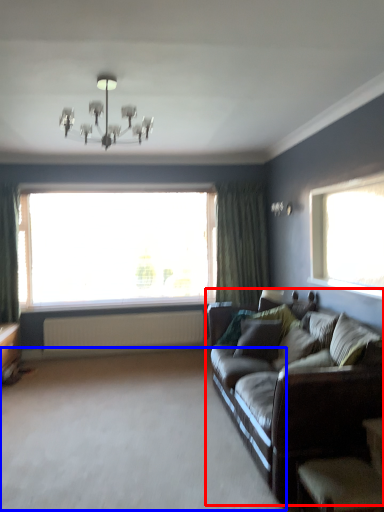
Question: Which point is closer to the camera, studio couch (highlighted by a red box) or plain (highlighted by a blue box)?

Choices:
 (A) studio couch
 (B) plain

Answer: (B)